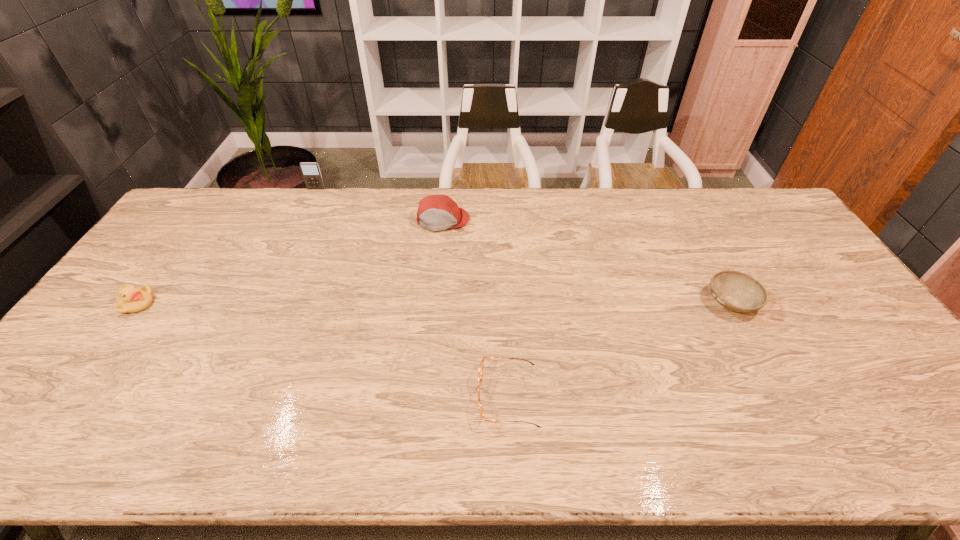
I want to click on vacant space at the near edge of the desktop, so click(x=180, y=431).

Image resolution: width=960 pixels, height=540 pixels. What are the coordinates of `vacant space at the left edge of the desktop` in the screenshot? It's located at (202, 231).

Find the location of a particular element. blank space at the right edge of the desktop is located at coordinates (806, 301).

Where is `unoccupied position between the farthest object and the third object from right to left`? Image resolution: width=960 pixels, height=540 pixels. unoccupied position between the farthest object and the third object from right to left is located at coordinates (379, 205).

You are a GUI agent. You are given a task and a screenshot of the screen. Output one action in this format:
    pyautogui.click(x=<x>, y=<y>)
    Task: Click on the vacant area that lies between the duckling and the second object from right to left
    The height and width of the screenshot is (540, 960).
    Given the screenshot: What is the action you would take?
    pyautogui.click(x=322, y=350)

You are a GUI agent. You are given a task and a screenshot of the screen. Output one action in this format:
    pyautogui.click(x=<x>, y=<y>)
    Task: Click on the vacant space that's between the fourth object from right to left and the leftmost object
    The height and width of the screenshot is (540, 960).
    Given the screenshot: What is the action you would take?
    pyautogui.click(x=227, y=246)

Where is `free spot between the rightmost object and the duckling`? Image resolution: width=960 pixels, height=540 pixels. free spot between the rightmost object and the duckling is located at coordinates (434, 303).

The image size is (960, 540). In order to click on vacant space that's between the fourth nearest object and the nearest object in this screenshot , I will do `click(475, 308)`.

The width and height of the screenshot is (960, 540). Find the location of `free space between the duckling and the fourth nearest object`. free space between the duckling and the fourth nearest object is located at coordinates (290, 262).

Where is `free point between the spectacles and the leftmost object`? free point between the spectacles and the leftmost object is located at coordinates (322, 350).